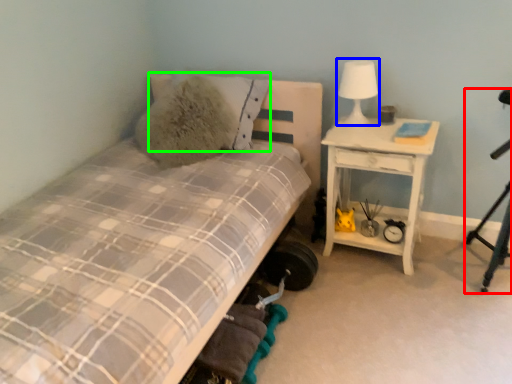
Question: Estimate the real-world distances between objects in this image. Which object is farther from tripod (highlighted by a red box), table lamp (highlighted by a blue box) or pillow (highlighted by a green box)?

Choices:
 (A) table lamp
 (B) pillow

Answer: (B)